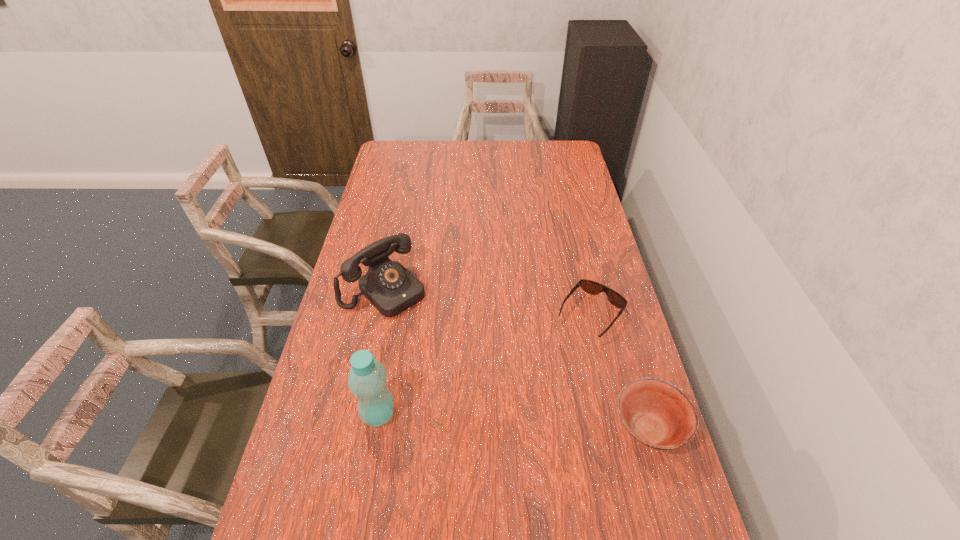
The width and height of the screenshot is (960, 540). I want to click on vacant area located on the front-facing side of the sunglasses, so click(534, 390).

At what (x,y) coordinates should I click in order to perform the action: click on vacant space located 0.390m on the front-facing side of the sunglasses. Please return your answer as a coordinate pair (x, y). Image resolution: width=960 pixels, height=540 pixels. Looking at the image, I should click on (499, 435).

This screenshot has width=960, height=540. What are the coordinates of `bottle positioned at the left edge` in the screenshot? It's located at (367, 379).

At what (x,y) coordinates should I click in order to perform the action: click on telephone at the left edge. Please return your answer as a coordinate pair (x, y). The height and width of the screenshot is (540, 960). Looking at the image, I should click on (389, 286).

You are a GUI agent. You are given a task and a screenshot of the screen. Output one action in this format:
    pyautogui.click(x=<x>, y=<y>)
    Task: Click on the bowl located in the right edge section of the desktop
    The height and width of the screenshot is (540, 960).
    Given the screenshot: What is the action you would take?
    pyautogui.click(x=657, y=414)

You are a GUI agent. You are given a task and a screenshot of the screen. Output one action in this format:
    pyautogui.click(x=<x>, y=<y>)
    Task: Click on the sunglasses located at the right edge
    Image resolution: width=960 pixels, height=540 pixels.
    Given the screenshot: What is the action you would take?
    pyautogui.click(x=591, y=287)

Where is `free region at the far edge`? free region at the far edge is located at coordinates (509, 152).

This screenshot has height=540, width=960. In the image, there is a desktop. Identify the location of vacant space at the near edge. (443, 519).

This screenshot has height=540, width=960. Find the location of `vacant space at the left edge of the desktop`. vacant space at the left edge of the desktop is located at coordinates (337, 393).

Image resolution: width=960 pixels, height=540 pixels. Find the location of `vacant region at the right edge of the desktop`. vacant region at the right edge of the desktop is located at coordinates (587, 272).